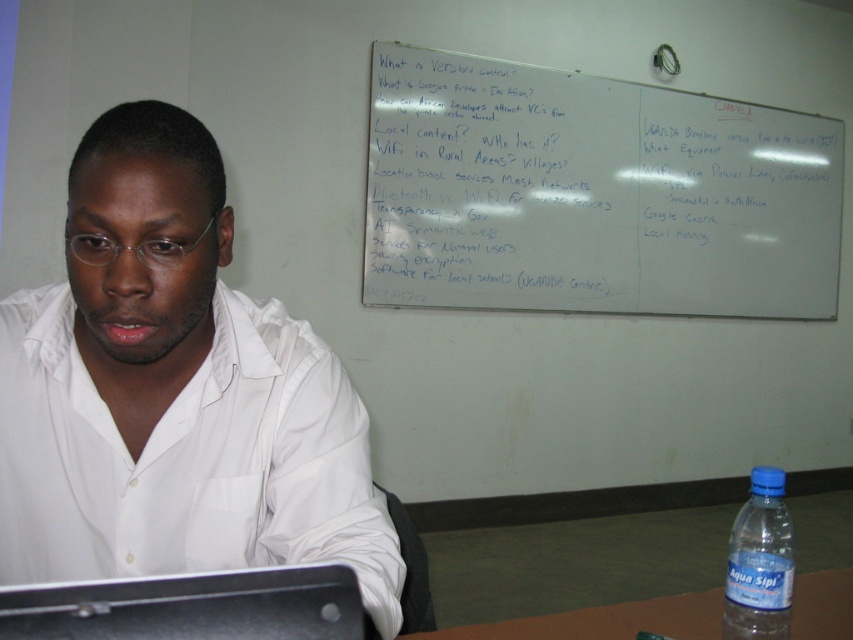
Question: Which is farther from the whiteboard at upper center?

Choices:
 (A) black matte laptop at lower left
 (B) brown wood table at lower right
 (C) blue plastic bottle at lower right

Answer: (A)

Question: Among these objects, which one is farthest from the camera?

Choices:
 (A) black matte laptop at lower left
 (B) brown wood table at lower right
 (C) white matte shirt at center
 (D) whiteboard at upper center

Answer: (D)

Question: Which of these objects is positioned farthest from the blue plastic bottle at lower right?

Choices:
 (A) black matte laptop at lower left
 (B) brown wood table at lower right
 (C) whiteboard at upper center

Answer: (C)

Question: From the image, what is the correct spatial relationship of black matte laptop at lower left in relation to brown wood table at lower right?

Choices:
 (A) left
 (B) right

Answer: (A)

Question: Can you confirm if white matte shirt at center is positioned below whiteboard at upper center?

Choices:
 (A) yes
 (B) no

Answer: (A)

Question: Does black matte laptop at lower left have a smaller size compared to brown wood table at lower right?

Choices:
 (A) yes
 (B) no

Answer: (A)